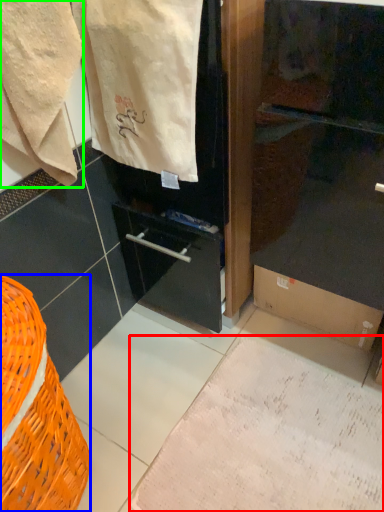
Question: Based on their relative distances, which object is farther from parchment (highlighted by a red box)? Choose from basket (highlighted by a blue box) and towel (highlighted by a green box).

Choices:
 (A) basket
 (B) towel

Answer: (B)